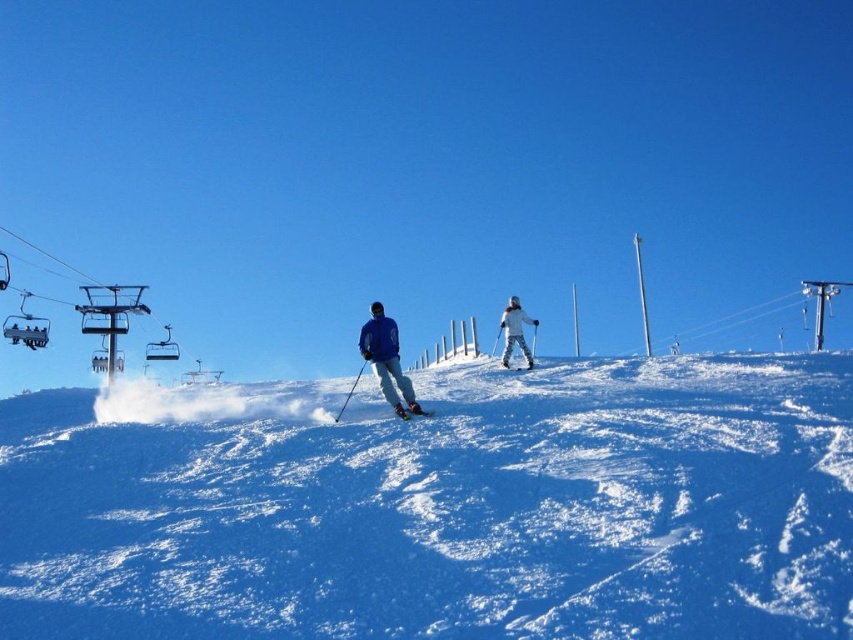
Which of these two, matte blue ski at center or white matte ski at center, stands taller?

matte blue ski at center is taller.

Is matte blue ski at center below white matte ski at center?

Yes.

Identify the location of matte blue ski at center. The height and width of the screenshot is (640, 853). (410, 412).

Is white snowsuit at center to the right of matte blue ski at center from the viewer's perspective?

Correct, you'll find white snowsuit at center to the right of matte blue ski at center.

Who is more forward, (520, 332) or (430, 413)?

Point (430, 413) is more forward.

The image size is (853, 640). Describe the element at coordinates (515, 330) in the screenshot. I see `white snowsuit at center` at that location.

Identify the location of white snowsuit at center. (515, 330).

Can you confirm if white powdery snow at center is shorter than matte blue ski at center?

No, white powdery snow at center is not shorter than matte blue ski at center.

Which is behind, point (138, 499) or point (428, 413)?

The point (428, 413) is more distant.

Between point (219, 406) and point (398, 413), which one is positioned behind?

Point (219, 406)

You are a GUI agent. You are given a task and a screenshot of the screen. Output one action in this format:
    pyautogui.click(x=<x>, y=<y>)
    Task: Click on the white powdery snow at center
    This screenshot has width=853, height=640.
    Given the screenshot: What is the action you would take?
    pyautogui.click(x=438, y=506)